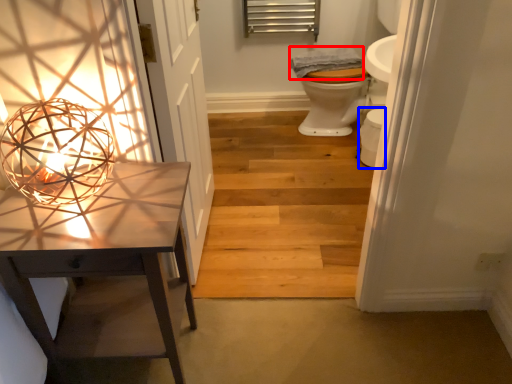
Question: Which object is closer to the camera taking this photo, material (highlighted by a red box) or toilet bowl (highlighted by a blue box)?

Choices:
 (A) material
 (B) toilet bowl

Answer: (B)